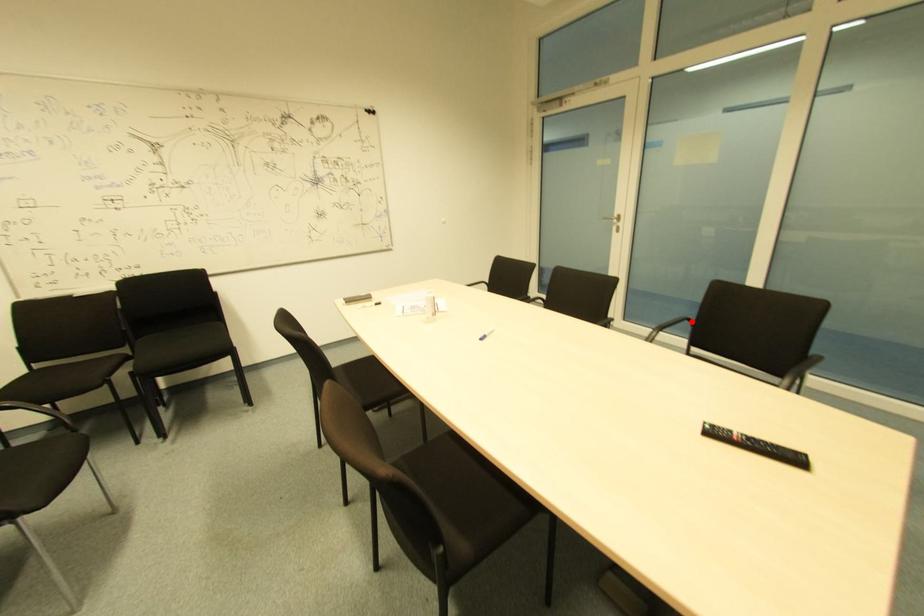
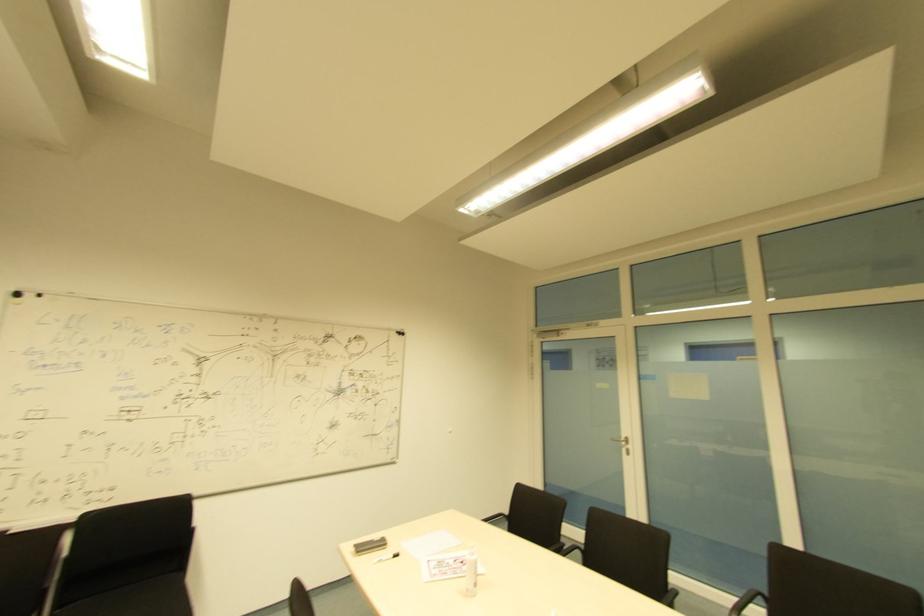
Locate, in the second image, the point that corresponds to the highlighted location in the first image.

(766, 599)